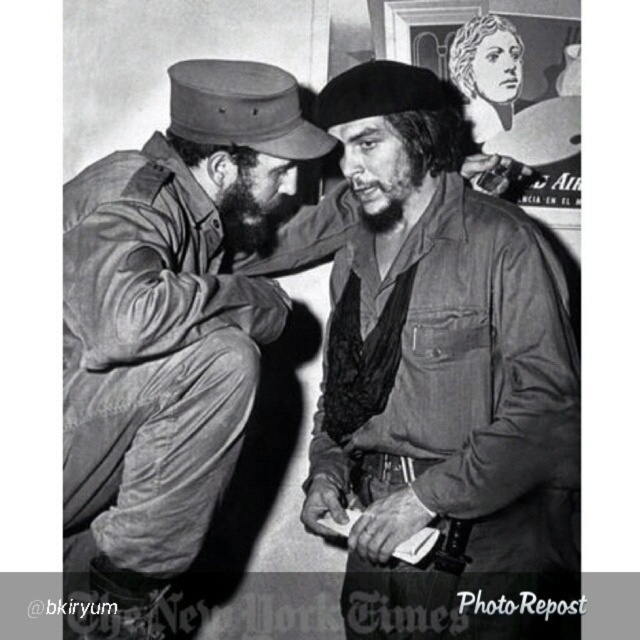
Which is above, dark brown leather jacket at center or black matte beard at center?

black matte beard at center is higher up.

Between point (497, 596) and point (276, 186), which one is positioned in front?

Point (497, 596) is more forward.

The image size is (640, 640). I want to click on dark brown leather jacket at center, so click(x=442, y=380).

Find the location of a particular element. dark brown leather jacket at center is located at coordinates (442, 380).

Between dark brown leather jacket at center and rugged canvas jacket at left, which one is positioned higher?

Positioned higher is dark brown leather jacket at center.

Is point (506, 573) behind point (230, 330)?

No, (506, 573) is closer to viewer.

Image resolution: width=640 pixels, height=640 pixels. In order to click on dark brown leather jacket at center in this screenshot , I will do `click(442, 380)`.

Is rugged canvas jacket at left bigger than black matte beard at center?

Yes, rugged canvas jacket at left is bigger than black matte beard at center.

Does rugged canvas jacket at left have a lesser height compared to black matte beard at center?

No, rugged canvas jacket at left is not shorter than black matte beard at center.

Which is in front, point (204, 451) or point (257, 248)?

Positioned in front is point (204, 451).

The image size is (640, 640). I want to click on rugged canvas jacket at left, so click(x=170, y=330).